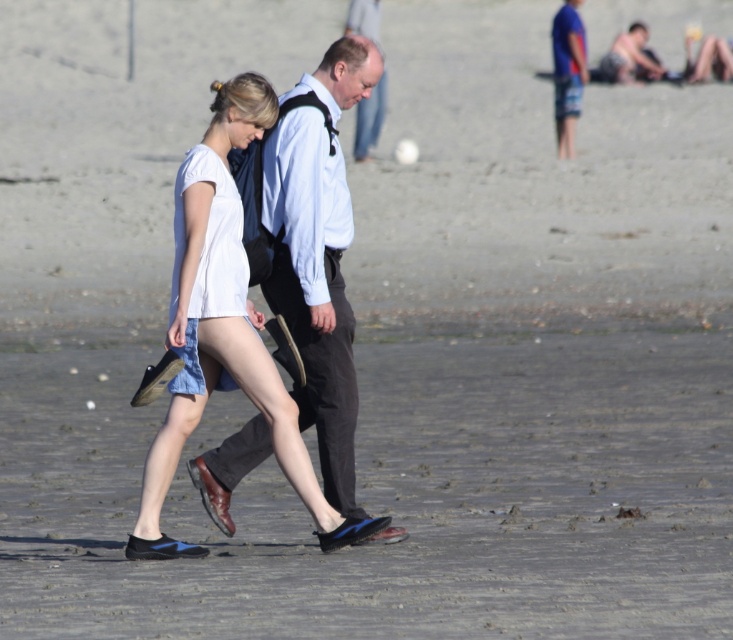
Question: Can you confirm if white denim dress at center is positioned to the left of light blue shirt at center?

Choices:
 (A) yes
 (B) no

Answer: (A)

Question: Considering the real-world distances, which object is closest to the light blue shirt at center?

Choices:
 (A) matte black shirt at center
 (B) blue denim shorts at upper right
 (C) white denim dress at center

Answer: (A)

Question: Is matte black shirt at center to the right of white denim dress at center from the viewer's perspective?

Choices:
 (A) yes
 (B) no

Answer: (A)

Question: Is matte black shirt at center positioned at the back of blue denim shorts at upper right?

Choices:
 (A) no
 (B) yes

Answer: (A)

Question: Among these objects, which one is farthest from the camera?

Choices:
 (A) light blue shirt at center
 (B) matte black shirt at center
 (C) white denim dress at center

Answer: (A)

Question: Estimate the real-world distances between objects in this image. Which object is closer to the matte black shirt at center?

Choices:
 (A) light blue shirt at center
 (B) blue denim shorts at upper right

Answer: (A)